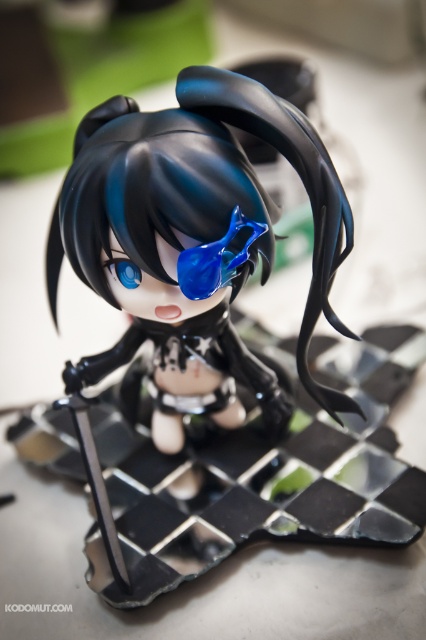
You are an art student analyzing the figurine. You need to locate the satin black hair at center for your sketch. Where exactly is it positioned on the figurine?

The satin black hair at center is positioned at point [135,189].

You are a collector who wants to display the satin black hair at center and transparent blue goggles at center on a shelf. If the shelf has a height limit of 10 cm, can both items be displayed without exceeding the height limit?

The satin black hair at center is taller than transparent blue goggles at center. However, since the height limit is 10 cm, both items can be displayed as long as their individual heights are under 10 cm. The description does not provide exact measurements, so it is possible if they meet the requirement.